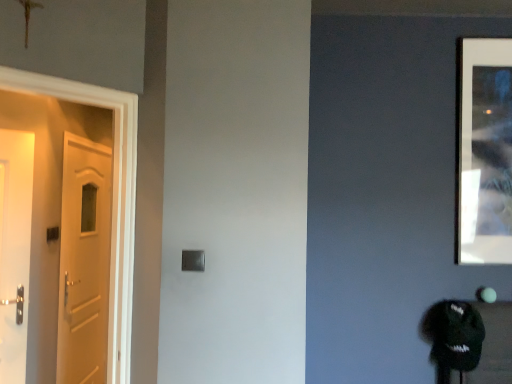
This screenshot has width=512, height=384. Describe the element at coordinates (112, 201) in the screenshot. I see `white glossy door at left` at that location.

At what (x,y) coordinates should I click in order to perform the action: click on white glossy door at left. Please return your answer as a coordinate pair (x, y). This screenshot has height=384, width=512. Looking at the image, I should click on (112, 201).

You are a GUI agent. You are given a task and a screenshot of the screen. Output one action in this format:
    pyautogui.click(x=<x>, y=<y>)
    Task: Click on the metallic silver frame at upper right
    The image size is (512, 384).
    Given the screenshot: What is the action you would take?
    pyautogui.click(x=485, y=151)

What is the approximate width of metallic silver frame at upper right?

metallic silver frame at upper right is 0.97 inches in width.

What do you see at coordinates (485, 151) in the screenshot?
I see `metallic silver frame at upper right` at bounding box center [485, 151].

The width and height of the screenshot is (512, 384). What are the coordinates of `white glossy door at left` in the screenshot? It's located at (112, 201).

Which is more to the right, white glossy door at left or metallic silver frame at upper right?

Positioned to the right is metallic silver frame at upper right.

Which object is closer to the camera taking this photo, white glossy door at left or metallic silver frame at upper right?

white glossy door at left.

Is point (112, 374) farther from viewer compared to point (502, 241)?

No, (112, 374) is in front of (502, 241).

From the image's perspective, which is above, white glossy door at left or metallic silver frame at upper right?

metallic silver frame at upper right is shown above in the image.

From a real-world perspective, is white glossy door at left positioned under metallic silver frame at upper right based on gravity?

Indeed, from a real-world perspective, white glossy door at left is positioned beneath metallic silver frame at upper right.

Based on the photo, which object is thinner, white glossy door at left or metallic silver frame at upper right?

metallic silver frame at upper right.

Considering the relative sizes of white glossy door at left and metallic silver frame at upper right in the image provided, is white glossy door at left shorter than metallic silver frame at upper right?

In fact, white glossy door at left may be taller than metallic silver frame at upper right.

Considering the sizes of white glossy door at left and metallic silver frame at upper right in the image, is white glossy door at left bigger or smaller than metallic silver frame at upper right?

white glossy door at left is bigger than metallic silver frame at upper right.

Would you say white glossy door at left contains metallic silver frame at upper right?

No, white glossy door at left does not contain metallic silver frame at upper right.

Is white glossy door at left positioned far away from metallic silver frame at upper right?

Yes, white glossy door at left and metallic silver frame at upper right are quite far apart.

Could you tell me if white glossy door at left is facing metallic silver frame at upper right?

No, white glossy door at left is not turned towards metallic silver frame at upper right.

What's the angular difference between white glossy door at left and metallic silver frame at upper right's facing directions?

They differ by 45.5 degrees in their facing directions.

The image size is (512, 384). What are the coordinates of `picture frame on the right of white glossy door at left` in the screenshot? It's located at (485, 151).

Based on the photo, which object is positioned more to the left, metallic silver frame at upper right or white glossy door at left?

Positioned to the left is white glossy door at left.

Consider the image. Is metallic silver frame at upper right in front of or behind white glossy door at left in the image?

metallic silver frame at upper right is positioned farther from the viewer than white glossy door at left.

Considering the points (460, 128) and (129, 202), which point is in front, point (460, 128) or point (129, 202)?

Point (129, 202)

From the image's perspective, is metallic silver frame at upper right under white glossy door at left?

No, from the image's perspective, metallic silver frame at upper right is not below white glossy door at left.

From a real-world perspective, between metallic silver frame at upper right and white glossy door at left, who is vertically lower?

white glossy door at left, from a real-world perspective.

Considering the sizes of metallic silver frame at upper right and white glossy door at left in the image, is metallic silver frame at upper right wider or thinner than white glossy door at left?

Considering their sizes, metallic silver frame at upper right looks slimmer than white glossy door at left.

Considering the sizes of metallic silver frame at upper right and white glossy door at left in the image, is metallic silver frame at upper right taller or shorter than white glossy door at left?

In the image, metallic silver frame at upper right appears to be shorter than white glossy door at left.

Between metallic silver frame at upper right and white glossy door at left, which one has smaller size?

metallic silver frame at upper right.

Would you say metallic silver frame at upper right is outside white glossy door at left?

Indeed, metallic silver frame at upper right is completely outside white glossy door at left.

Can you see metallic silver frame at upper right touching white glossy door at left?

No, metallic silver frame at upper right is not making contact with white glossy door at left.

Is metallic silver frame at upper right looking in the opposite direction of white glossy door at left?

No, white glossy door at left is not at the back of metallic silver frame at upper right.

Can you tell me how much metallic silver frame at upper right and white glossy door at left differ in facing direction?

There is a 45.5-degree angle between the facing directions of metallic silver frame at upper right and white glossy door at left.

How much distance is there between metallic silver frame at upper right and white glossy door at left?

The distance of metallic silver frame at upper right from white glossy door at left is 5.04 feet.

The width and height of the screenshot is (512, 384). Identify the location of door that is on the left side of metallic silver frame at upper right. (112, 201).

Identify the location of picture frame that appears on the right of white glossy door at left. The height and width of the screenshot is (384, 512). (485, 151).

Where is `picture frame above the white glossy door at left (from a real-world perspective)`? picture frame above the white glossy door at left (from a real-world perspective) is located at coordinates (485, 151).